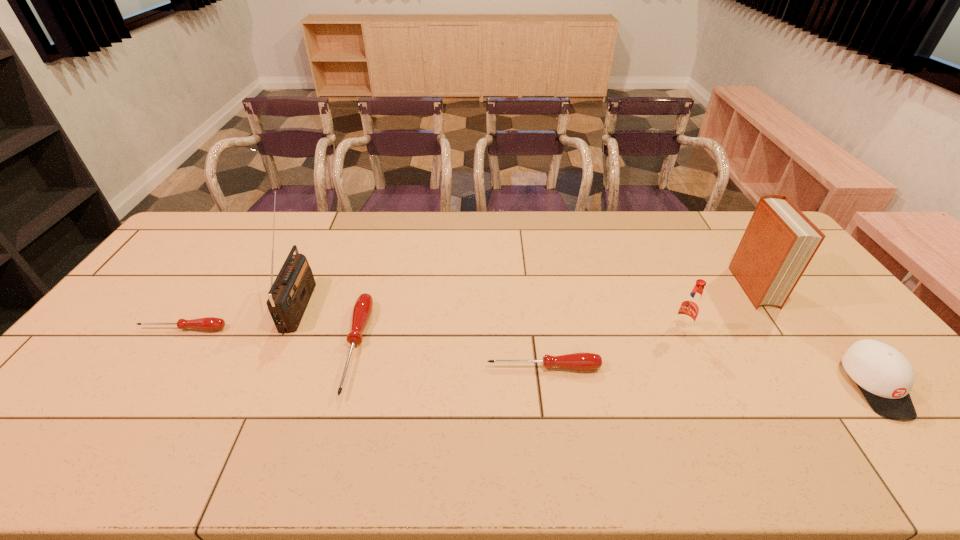
Identify the location of object located in the left edge section of the desktop. The image size is (960, 540). (209, 323).

Find the location of a particular element. The height and width of the screenshot is (540, 960). object at the right edge is located at coordinates (885, 377).

Where is `object that is at the near right corner`? The width and height of the screenshot is (960, 540). object that is at the near right corner is located at coordinates (885, 377).

What are the coordinates of `free space at the far edge` in the screenshot? It's located at (699, 227).

Locate an element on the screen. The height and width of the screenshot is (540, 960). free space at the near edge of the desktop is located at coordinates (311, 395).

Locate an element on the screen. free space at the left edge is located at coordinates (118, 347).

Identify the location of free space at the right edge. (862, 334).

The height and width of the screenshot is (540, 960). I want to click on free region at the far right corner of the desktop, so click(x=733, y=218).

Locate an element on the screen. Image resolution: width=960 pixels, height=540 pixels. free space between the hardback book and the second shortest screwdriver is located at coordinates (648, 327).

This screenshot has height=540, width=960. In order to click on free space between the hardback book and the radio receiver in this screenshot , I will do `click(526, 295)`.